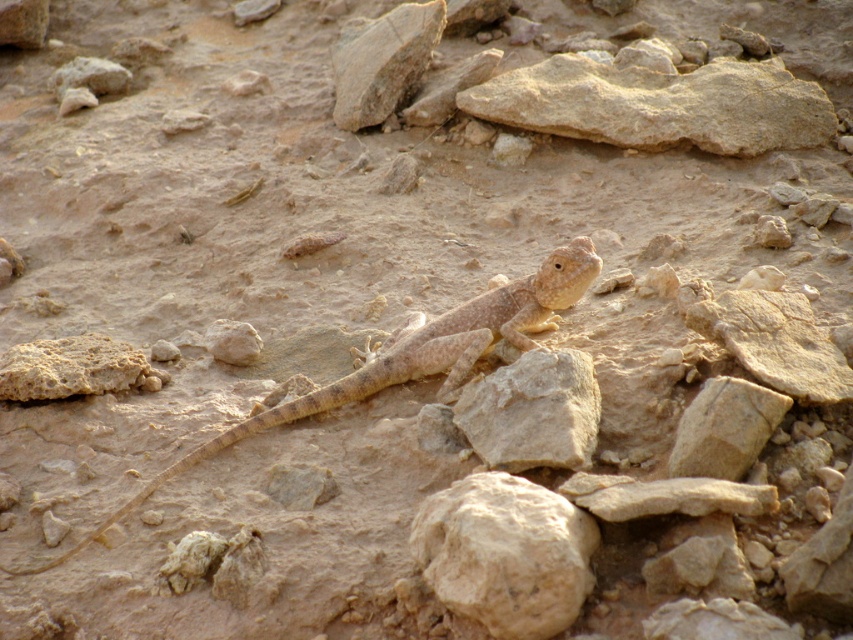
You are a photographer standing in the desert scene. You want to take a photo that includes both point (520, 522) and point (335, 387). Which point will appear closer to the front of the photo?

Point (520, 522) is closer to the camera than point (335, 387), so it will appear closer to the front of the photo.